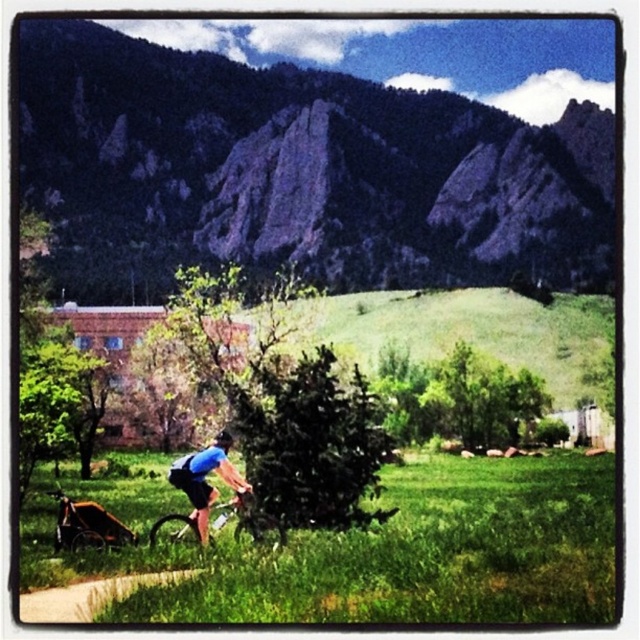
Can you confirm if matte black mountain bike at center is positioned to the right of black matte bicycle helmet at center?

Yes, matte black mountain bike at center is to the right of black matte bicycle helmet at center.

Between point (186, 528) and point (214, 436), which one is positioned behind?

The point (214, 436) is more distant.

Where is `matte black mountain bike at center`? matte black mountain bike at center is located at coordinates (232, 508).

You are a GUI agent. You are given a task and a screenshot of the screen. Output one action in this format:
    pyautogui.click(x=<x>, y=<y>)
    Task: Click on the matte black mountain bike at center
    The image size is (640, 640).
    Given the screenshot: What is the action you would take?
    pyautogui.click(x=232, y=508)

Who is more forward, (464, 116) or (97, 541)?

Positioned in front is point (97, 541).

Is point (573, 115) more distant than point (74, 504)?

Yes, it is behind point (74, 504).

Is point (438, 276) more distant than point (102, 520)?

Yes, it is.

The image size is (640, 640). Identify the location of green rock formation at center. (298, 172).

You are a GUI agent. You are given a task and a screenshot of the screen. Output one action in this format:
    pyautogui.click(x=<x>, y=<y>)
    Task: Click on the green rock formation at center
    Image resolution: width=640 pixels, height=640 pixels.
    Given the screenshot: What is the action you would take?
    pyautogui.click(x=298, y=172)

Does green rock formation at center lie in front of matte black mountain bike at center?

No, green rock formation at center is behind matte black mountain bike at center.

Describe the element at coordinates (298, 172) in the screenshot. The height and width of the screenshot is (640, 640). I see `green rock formation at center` at that location.

Identify the location of green rock formation at center. This screenshot has width=640, height=640. (298, 172).